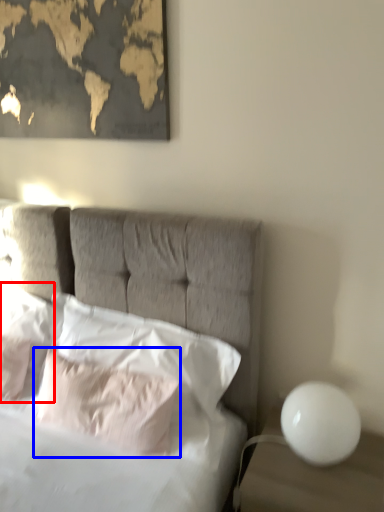
Question: Which object is further to the camera taking this photo, pillow (highlighted by a red box) or pillow (highlighted by a blue box)?

Choices:
 (A) pillow
 (B) pillow

Answer: (A)